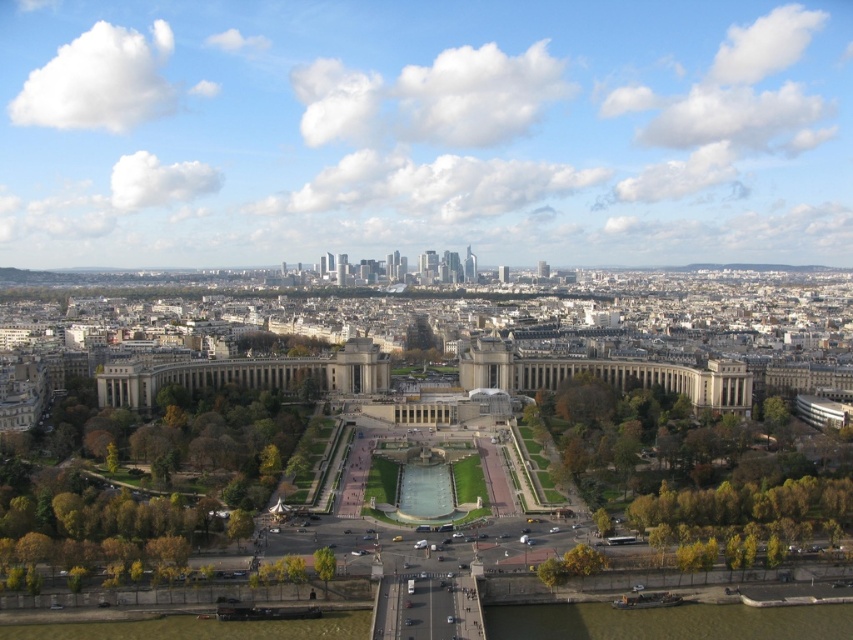
You are a tourist standing at the edge of the park in the cityscape. You see the white marble palace at center and the green leafy tree at lower center. Which object is positioned higher in the image?

The white marble palace at center is positioned higher than the green leafy tree at lower center in the image.

You are standing at the center of the park in the cityscape. You want to find the green leafy trees at lower left. Which direction should you face to see them?

You should face the lower left direction to see the green leafy trees at lower left located at point (142, 472).